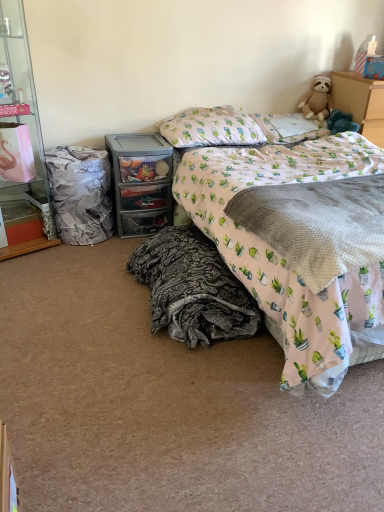
At what (x,y) coordinates should I click in order to perform the action: click on free space that is in between marble-patterned laundry basket at left and dark gray textured blanket at lower center, the second blanket viewed from the right. Please return your answer as a coordinate pair (x, y). This screenshot has height=512, width=384. Looking at the image, I should click on (107, 274).